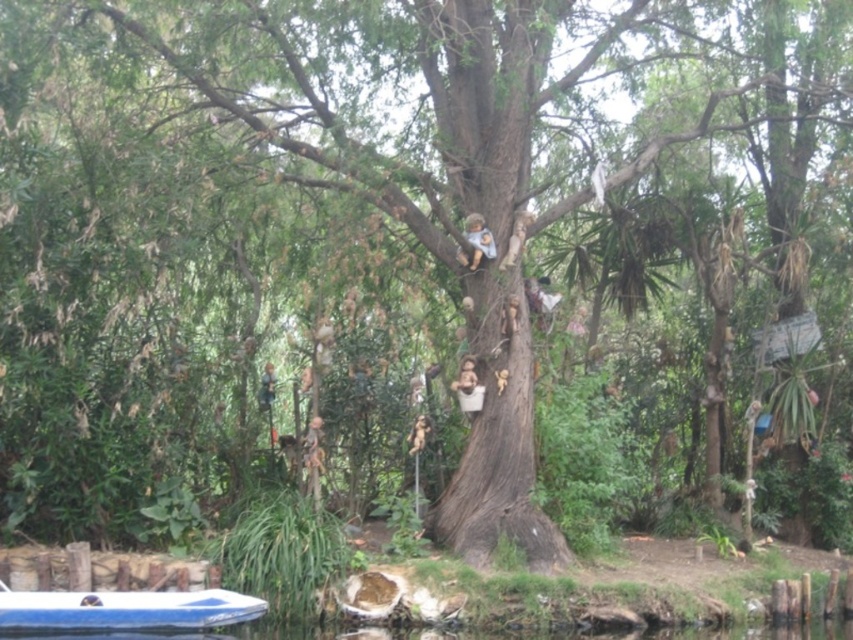
Question: Which object is the farthest from the blue plastic boat at lower left?

Choices:
 (A) smooth beige doll at upper center
 (B) wooden doll at center

Answer: (A)

Question: Is blue plastic boat at lower left wider than smooth beige doll at upper center?

Choices:
 (A) yes
 (B) no

Answer: (A)

Question: Which point appears farthest from the camera in this image?

Choices:
 (A) (467, 236)
 (B) (453, 390)

Answer: (B)

Question: Can you confirm if blue plastic boat at lower left is thinner than wooden doll at center?

Choices:
 (A) yes
 (B) no

Answer: (B)

Question: Can you confirm if smooth beige doll at upper center is smaller than wooden doll at center?

Choices:
 (A) no
 (B) yes

Answer: (B)

Question: Which of the following is the closest to the observer?

Choices:
 (A) smooth beige doll at upper center
 (B) blue plastic boat at lower left
 (C) wooden doll at center

Answer: (B)